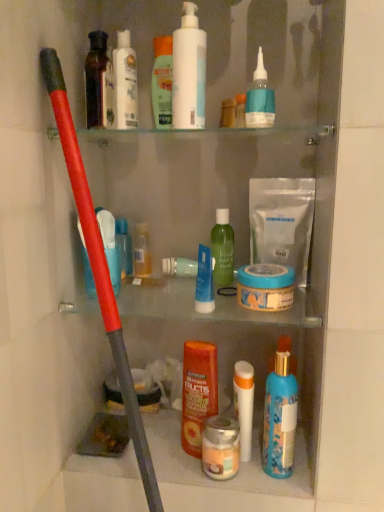
Question: Can you confirm if green matte lotion at upper center, which is the fifth toiletry in left-to-right order, is taller than blue glossy spray bottle at lower center, which is the first toiletry in right-to-left order?

Choices:
 (A) yes
 (B) no

Answer: (B)

Question: From the image's perspective, would you say green matte lotion at upper center, which is the fifth toiletry in left-to-right order, is shown under blue glossy spray bottle at lower center, arranged as the 11th toiletry when viewed from the left?

Choices:
 (A) no
 (B) yes

Answer: (A)

Question: Considering the relative positions of green matte lotion at upper center, arranged as the 7th toiletry when viewed from the right, and blue glossy spray bottle at lower center, arranged as the 11th toiletry when viewed from the left, in the image provided, is green matte lotion at upper center, arranged as the 7th toiletry when viewed from the right, to the right of blue glossy spray bottle at lower center, arranged as the 11th toiletry when viewed from the left, from the viewer's perspective?

Choices:
 (A) yes
 (B) no

Answer: (B)

Question: Considering the relative sizes of green matte lotion at upper center, which is the fifth toiletry in left-to-right order, and blue glossy spray bottle at lower center, arranged as the 11th toiletry when viewed from the left, in the image provided, is green matte lotion at upper center, which is the fifth toiletry in left-to-right order, smaller than blue glossy spray bottle at lower center, arranged as the 11th toiletry when viewed from the left,?

Choices:
 (A) yes
 (B) no

Answer: (A)

Question: Is green matte lotion at upper center, which is the fifth toiletry in left-to-right order, oriented away from blue glossy spray bottle at lower center, arranged as the 11th toiletry when viewed from the left?

Choices:
 (A) no
 (B) yes

Answer: (A)

Question: From a real-world perspective, is green matte lotion at upper center, arranged as the 7th toiletry when viewed from the right, above or below matte black bottle at upper left, the 10th toiletry positioned from the right?

Choices:
 (A) below
 (B) above

Answer: (B)

Question: Based on their positions, is green matte lotion at upper center, which is the fifth toiletry in left-to-right order, located to the left or right of matte black bottle at upper left, the 10th toiletry positioned from the right?

Choices:
 (A) left
 (B) right

Answer: (B)

Question: From the image's perspective, is green matte lotion at upper center, which is the fifth toiletry in left-to-right order, located above or below matte black bottle at upper left, placed as the second toiletry when sorted from left to right?

Choices:
 (A) above
 (B) below

Answer: (A)

Question: In terms of height, does green matte lotion at upper center, which is the fifth toiletry in left-to-right order, look taller or shorter compared to matte black bottle at upper left, the 10th toiletry positioned from the right?

Choices:
 (A) tall
 (B) short

Answer: (A)

Question: Which is correct: metallic silver jar at center, the 7th toiletry when ordered from left to right, is inside translucent plastic bottle at left, arranged as the eleventh toiletry when viewed from the right, or outside of it?

Choices:
 (A) outside
 (B) inside

Answer: (A)

Question: From a real-world perspective, is metallic silver jar at center, the 7th toiletry when ordered from left to right, above or below translucent plastic bottle at left, arranged as the eleventh toiletry when viewed from the right?

Choices:
 (A) above
 (B) below

Answer: (B)

Question: In terms of size, does metallic silver jar at center, the 7th toiletry when ordered from left to right, appear bigger or smaller than translucent plastic bottle at left, marked as the 1th toiletry in a left-to-right arrangement?

Choices:
 (A) big
 (B) small

Answer: (B)

Question: From the image's perspective, is metallic silver jar at center, the fifth toiletry in the right-to-left sequence, positioned above or below translucent plastic bottle at left, marked as the 1th toiletry in a left-to-right arrangement?

Choices:
 (A) above
 (B) below

Answer: (B)

Question: Is white matte tube at center, which appears as the third toiletry when viewed from the right, bigger or smaller than translucent plastic bottle at left, marked as the 1th toiletry in a left-to-right arrangement?

Choices:
 (A) big
 (B) small

Answer: (B)

Question: Is white matte tube at center, which ranks as the ninth toiletry in left-to-right order, taller or shorter than translucent plastic bottle at left, marked as the 1th toiletry in a left-to-right arrangement?

Choices:
 (A) tall
 (B) short

Answer: (B)